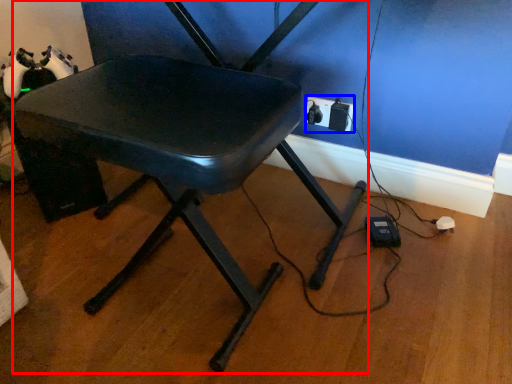
Question: Which point is closer to the camera, chair (highlighted by a red box) or electric outlet (highlighted by a blue box)?

Choices:
 (A) chair
 (B) electric outlet

Answer: (A)